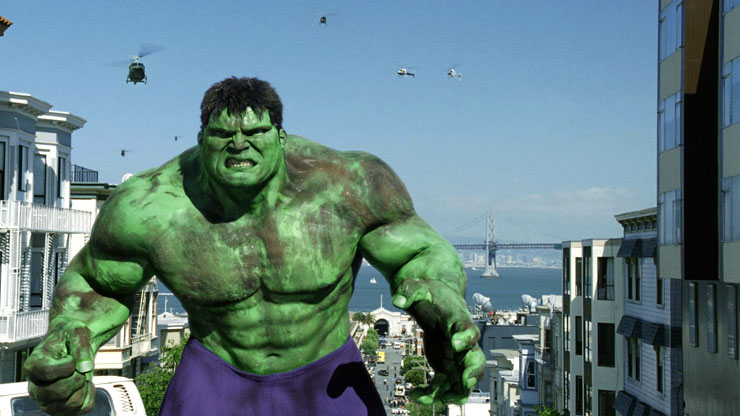
Identify the location of apartments. (35, 221), (653, 314).